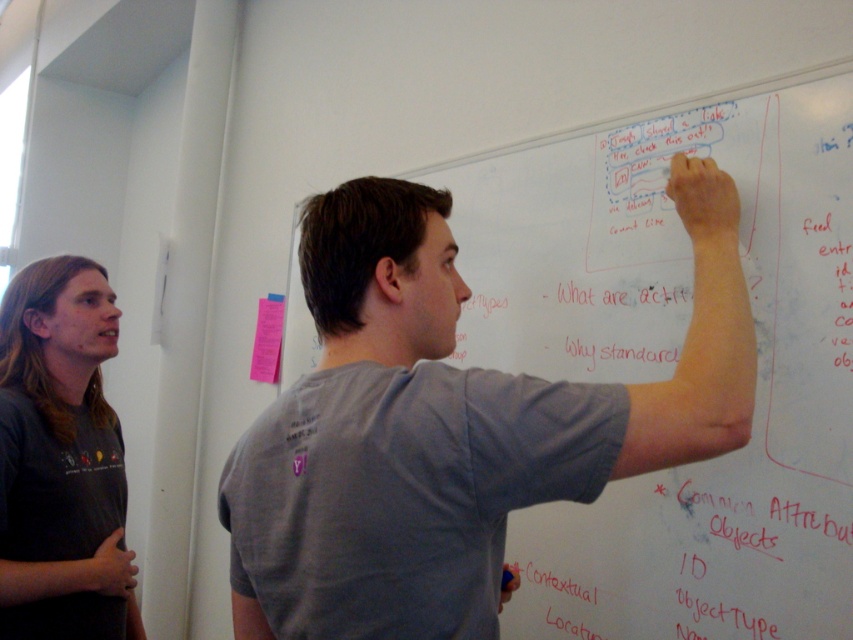
You are a security camera analyzing the scene. The gray matte shirt at upper center is located at a specific coordinate. Can you determine its position relative to the center of the image?

The gray matte shirt at upper center is located at point 0.664 on the x axis and 0.528 on the y axis, which means it is slightly to the right and above the center of the image.